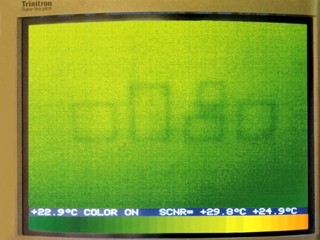
What are the coordinates of `bottom monitor frame` in the screenshot? It's located at (276, 238).